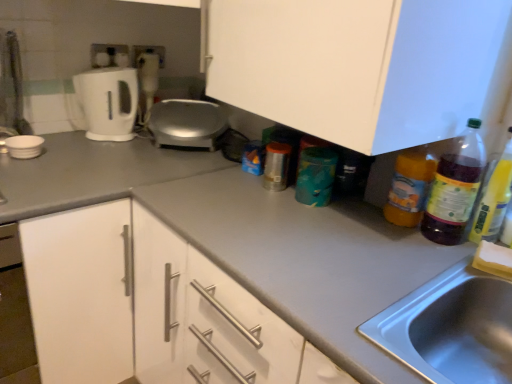
What are the coordinates of `vacant space situated on the left part of translucent plastic bottle at right, which appears as the second bottle when viewed from the left` in the screenshot? It's located at (411, 241).